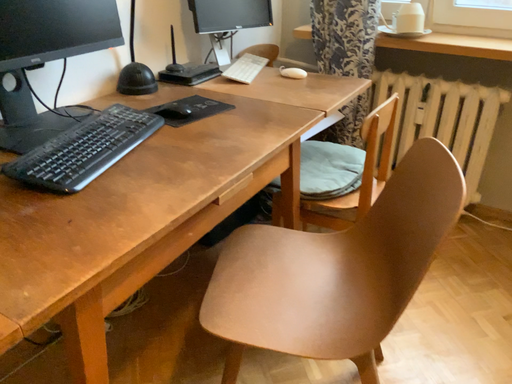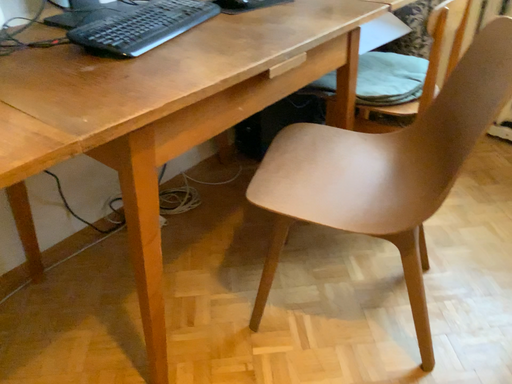
Question: Which way did the camera rotate in the video?

Choices:
 (A) rotated upward
 (B) rotated downward

Answer: (B)